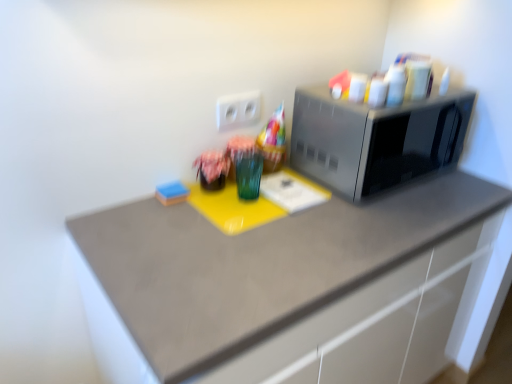
Identify the location of free space in front of green glass at center. This screenshot has width=512, height=384. (248, 247).